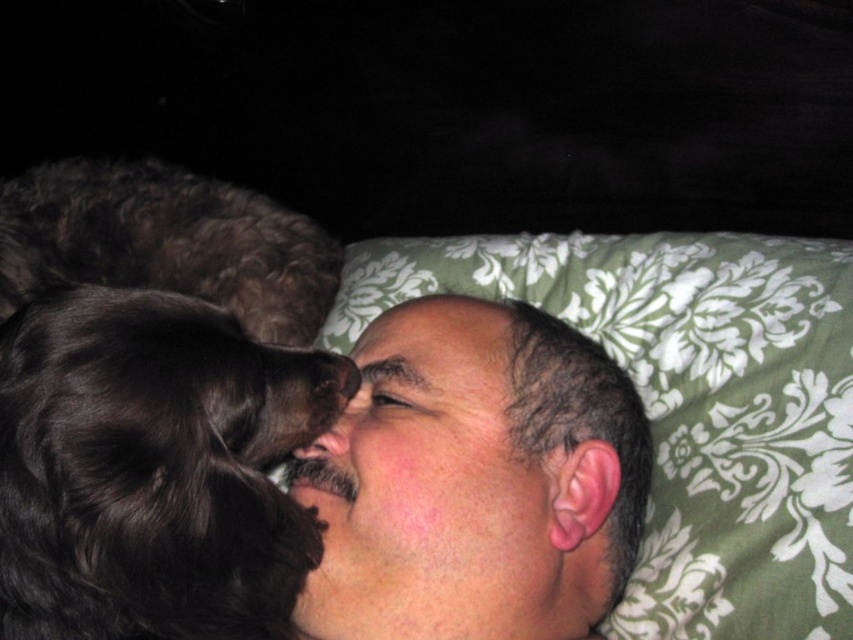
Question: Which point is closer to the camera taking this photo?

Choices:
 (A) (310, 580)
 (B) (355, 413)

Answer: (A)

Question: Which point is closer to the camera taking this photo?

Choices:
 (A) (4, 596)
 (B) (157, 193)
 (C) (366, 376)

Answer: (A)

Question: Is the position of dark brown fur at left more distant than that of brown fur nose at center?

Choices:
 (A) no
 (B) yes

Answer: (B)

Question: Is green floral fabric at center below dark brown fur at left?

Choices:
 (A) yes
 (B) no

Answer: (A)

Question: Estimate the real-world distances between objects in this image. Which object is farther from the green floral fabric at center?

Choices:
 (A) dark brown fur at left
 (B) smooth skin face at center
 (C) brown fur nose at center

Answer: (C)

Question: From the image, what is the correct spatial relationship of black fluffy dog at left in relation to dark brown fur at left?

Choices:
 (A) left
 (B) right

Answer: (B)